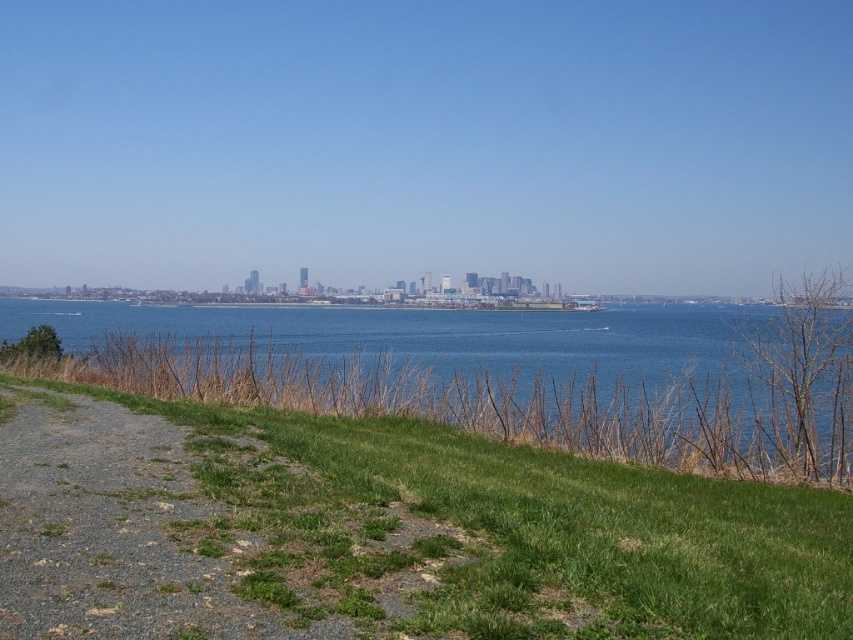
Question: Does green grassy slope at lower left appear under blue water at center?

Choices:
 (A) yes
 (B) no

Answer: (A)

Question: Can you confirm if green grassy slope at lower left is positioned to the right of blue water at center?

Choices:
 (A) yes
 (B) no

Answer: (B)

Question: Which object appears closest to the camera in this image?

Choices:
 (A) green grassy slope at lower left
 (B) blue water at center

Answer: (A)

Question: In this image, where is green grassy slope at lower left located relative to blue water at center?

Choices:
 (A) left
 (B) right

Answer: (A)

Question: Which point is closer to the camera taking this photo?

Choices:
 (A) (125, 307)
 (B) (614, 600)

Answer: (B)